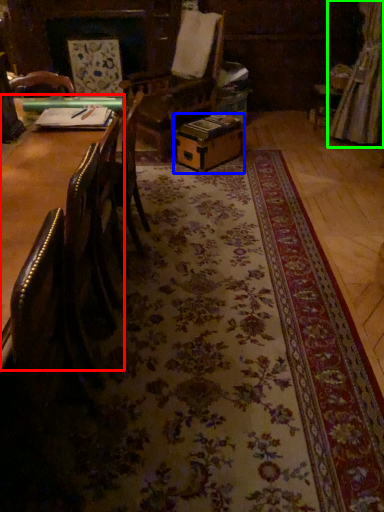
Question: Based on their relative distances, which object is farther from table (highlighted by a red box)? Choose from cardboard box (highlighted by a blue box) and curtain (highlighted by a green box).

Choices:
 (A) cardboard box
 (B) curtain

Answer: (B)